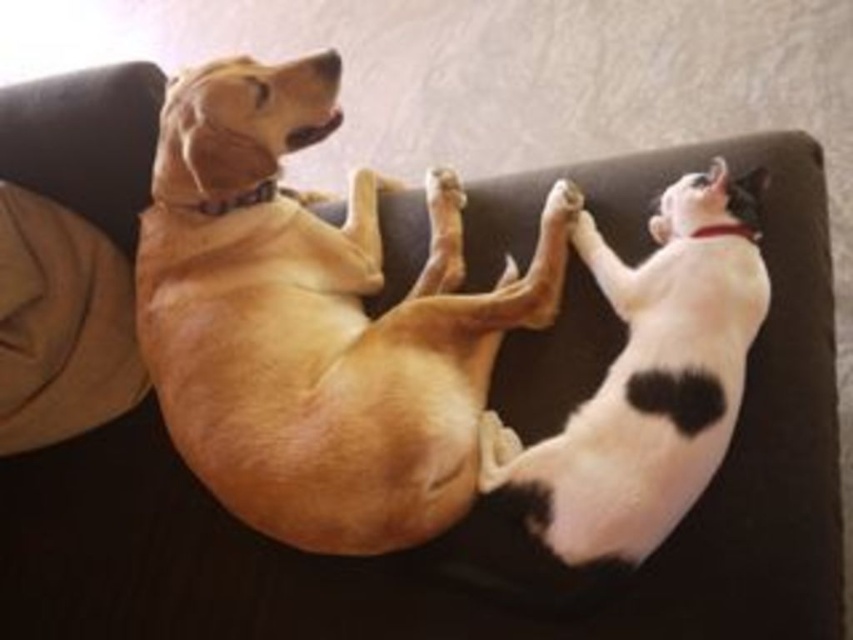
You are a photographer trying to capture a closeup of the white matte dog at center and the white fur paw at center. Since both are white, you want to ensure you can distinguish them in the photo. Based on their positions, which one is further to the right?

The white matte dog at center is further to the right compared to the white fur paw at center.

You are a photographer trying to capture a clear shot of the white matte dog at center and the white fur paw at upper center. Since both are white, you want to ensure they are distinguishable in the photo. According to the scene description, which one is closer to the camera?

The white matte dog at center is in front of the white fur paw at upper center, so it is closer to the camera and will appear more distinguishable in the photo.